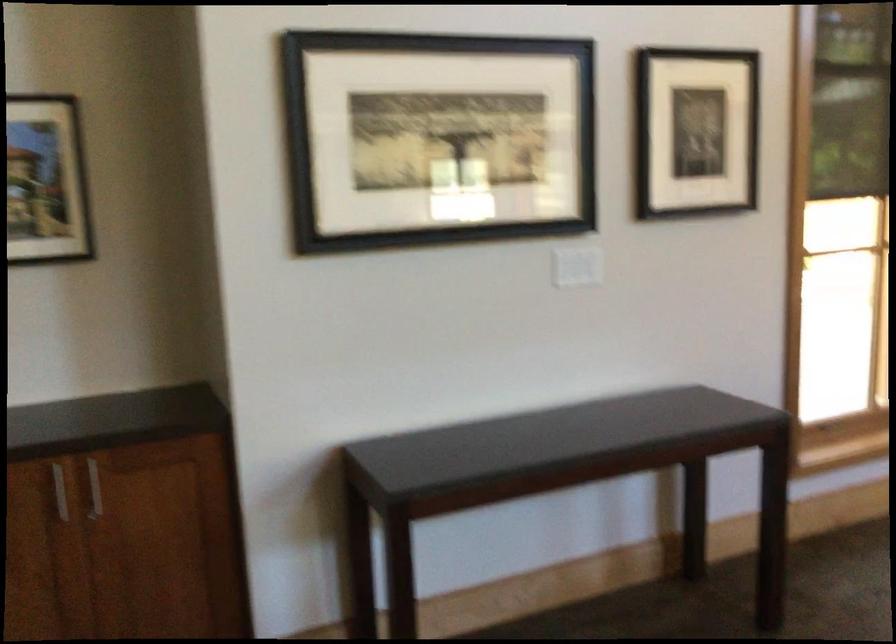
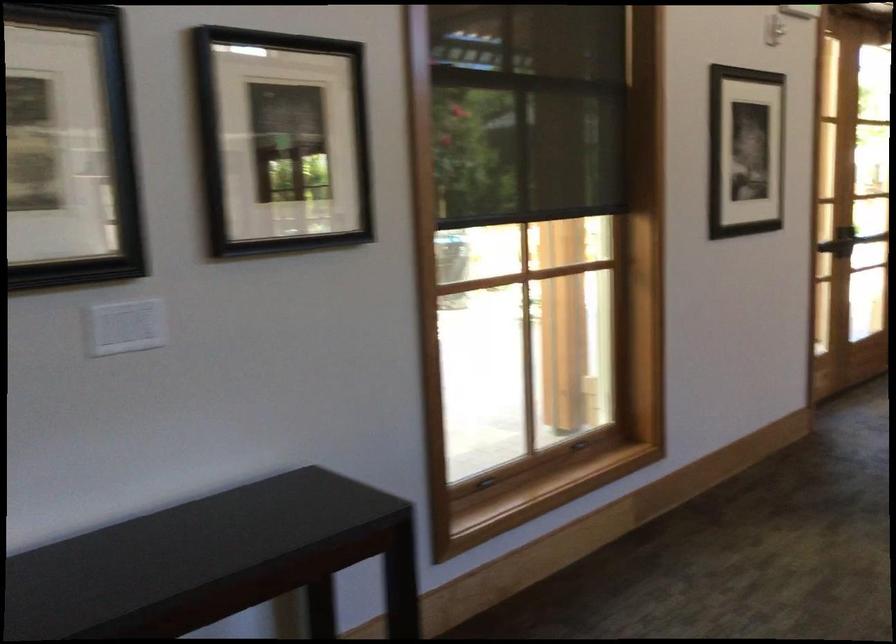
Question: How did the camera likely rotate?

Choices:
 (A) Left
 (B) Right
 (C) Up
 (D) Down

Answer: (B)